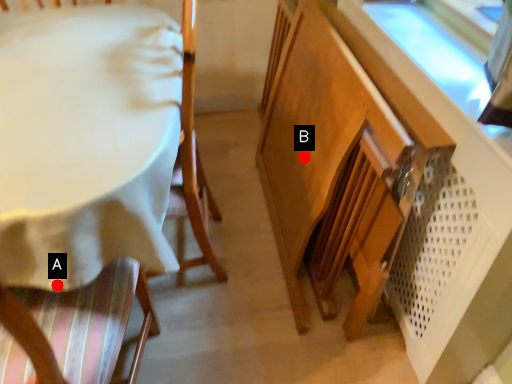
Question: Two points are circled on the image, labeled by A and B beside each circle. Which point is closer to the camera taking this photo?

Choices:
 (A) A is closer
 (B) B is closer

Answer: (A)